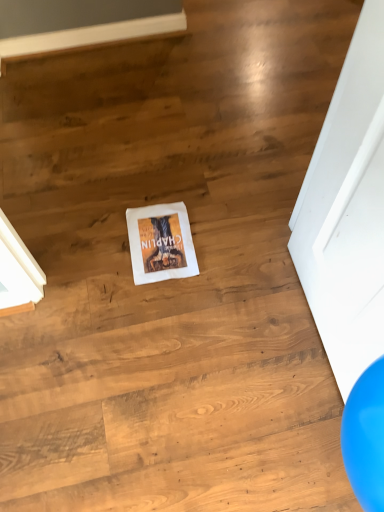
You are a GUI agent. You are given a task and a screenshot of the screen. Output one action in this format:
    pyautogui.click(x=<x>, y=<y>)
    Task: Click on the free space above white cloth at center (from a real-world perspective)
    
    Given the screenshot: What is the action you would take?
    pyautogui.click(x=161, y=241)